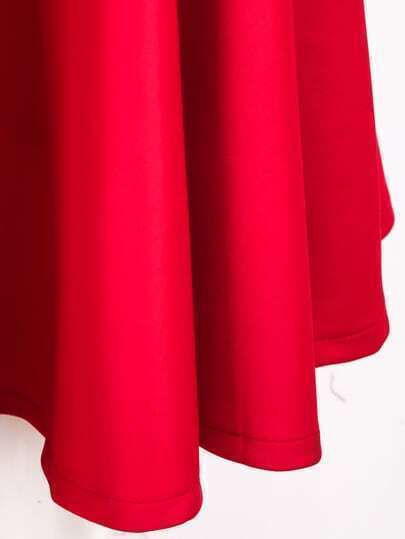
Where is `table cloth`? This screenshot has height=539, width=405. table cloth is located at coordinates (119, 414).